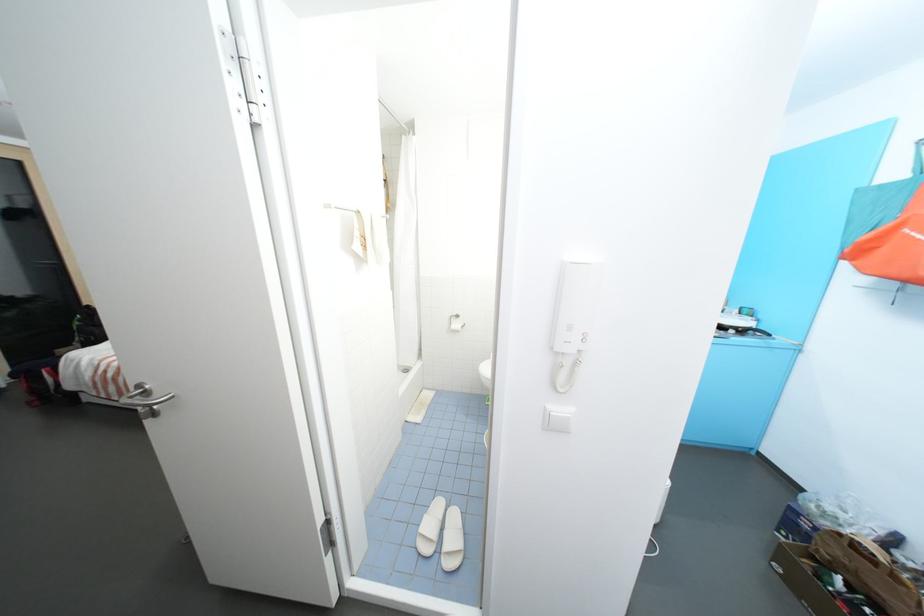
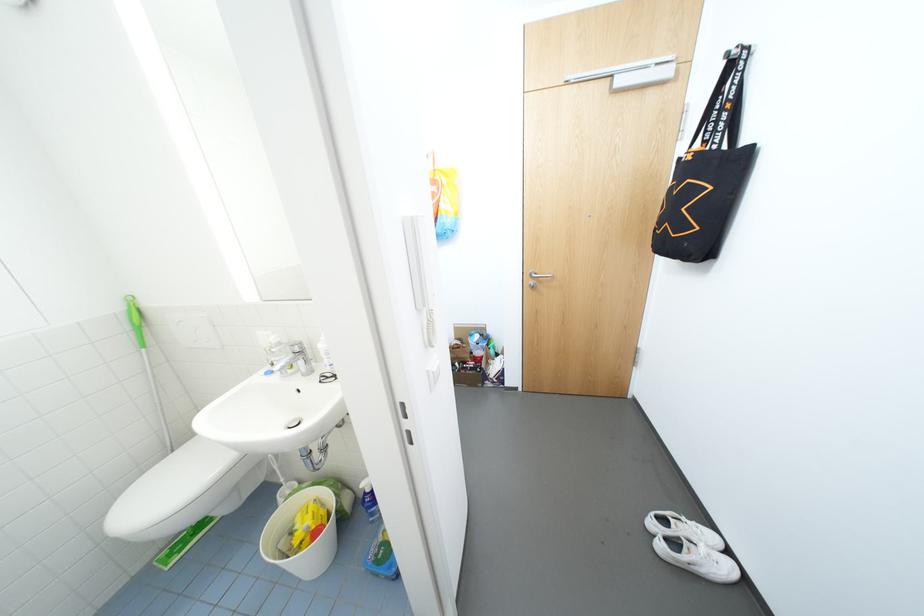
How did the camera likely rotate?

The camera's rotation is toward right-down.